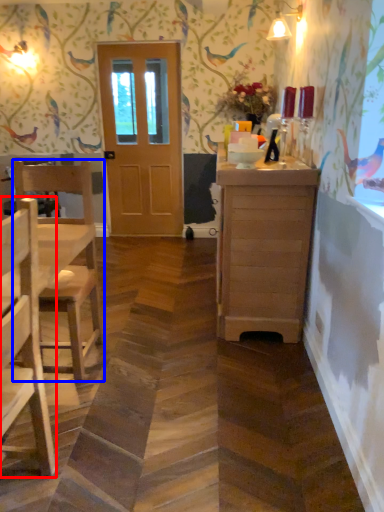
Question: Among these objects, which one is nearest to the camera, chair (highlighted by a red box) or chair (highlighted by a blue box)?

Choices:
 (A) chair
 (B) chair

Answer: (A)